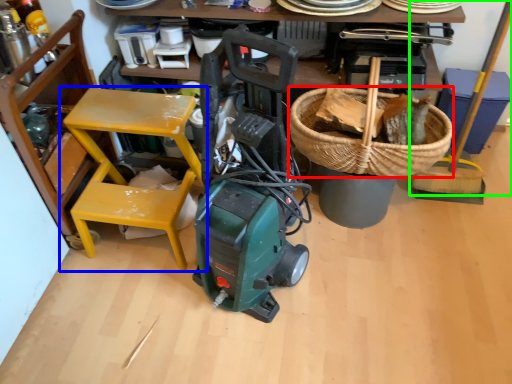
Question: Based on their relative distances, which object is nearer to basket (highlighted by a red box)? Choose from chair (highlighted by a blue box) and shovel (highlighted by a green box).

Choices:
 (A) chair
 (B) shovel

Answer: (B)